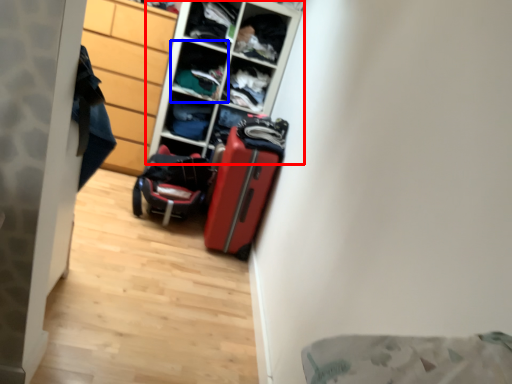
Question: Which point is further to the camera, shelf (highlighted by a red box) or shelf (highlighted by a blue box)?

Choices:
 (A) shelf
 (B) shelf

Answer: (B)